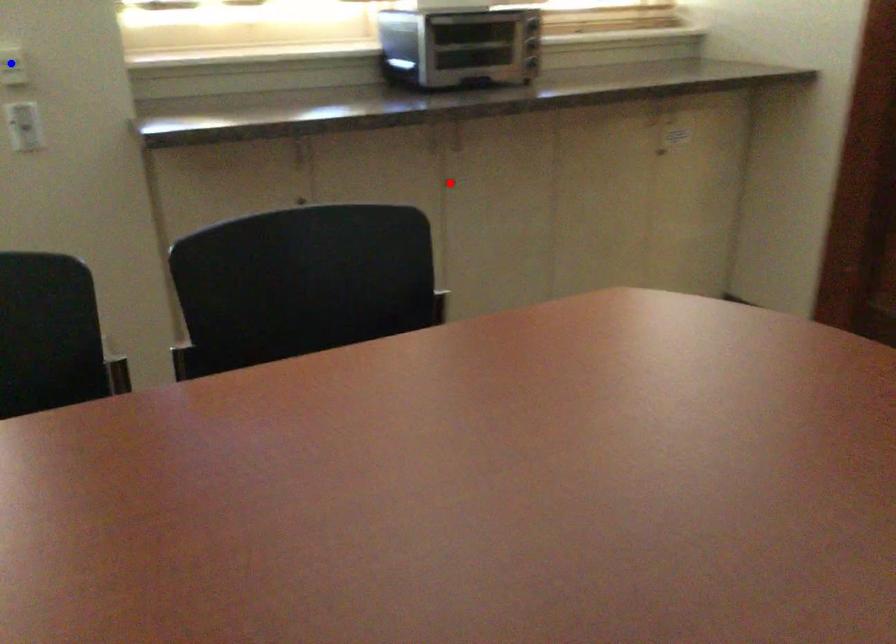
Question: In the image, two points are highlighted. Which point is nearer to the camera? Reply with the corresponding letter.

Choices:
 (A) blue point
 (B) red point

Answer: (A)